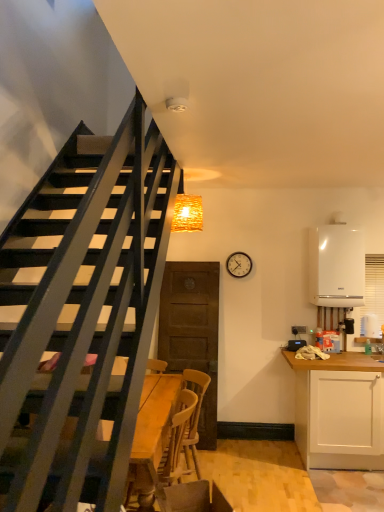
Question: Based on their positions, is wooden swivel chair at lower center located to the left or right of white glossy boiler at right?

Choices:
 (A) right
 (B) left

Answer: (B)

Question: Does point (175, 493) appear closer or farther from the camera than point (322, 249)?

Choices:
 (A) closer
 (B) farther

Answer: (A)

Question: Estimate the real-world distances between objects in this image. Which object is farther from the white matte cabinet at right?

Choices:
 (A) wooden at lower center
 (B) metallic round clock at upper right
 (C) white glossy boiler at right
 (D) wooden swivel chair at lower center
 (E) woven wood light fixture at upper center

Answer: (E)

Question: Which object is positioned closest to the wooden swivel chair at lower center?

Choices:
 (A) white glossy boiler at right
 (B) metallic round clock at upper right
 (C) woven wood light fixture at upper center
 (D) wooden at lower center
 (E) white matte cabinet at right

Answer: (D)